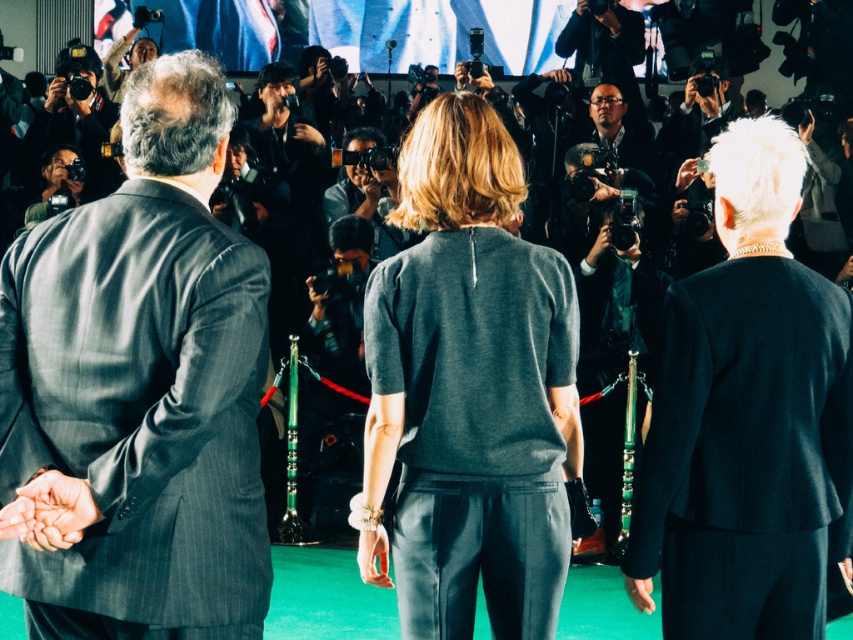
Based on the scene description, where are the smooth skin hands at center located in relation to the other individuals?

The smooth skin hands at center are located at point coordinates of 0.800 in the x axis and 0.059 in the y axis.

You are a photographer at the event and want to take a photo of the gray pinstripe suit at left and the smooth skin hands at center. Which object is positioned to the right of the other?

The gray pinstripe suit at left is to the right of the smooth skin hands at center.

Based on the provided scene description, where are the smooth skin hands at center located in terms of their 2D coordinates?

The smooth skin hands at center are located at the 2D coordinates point (49,512).